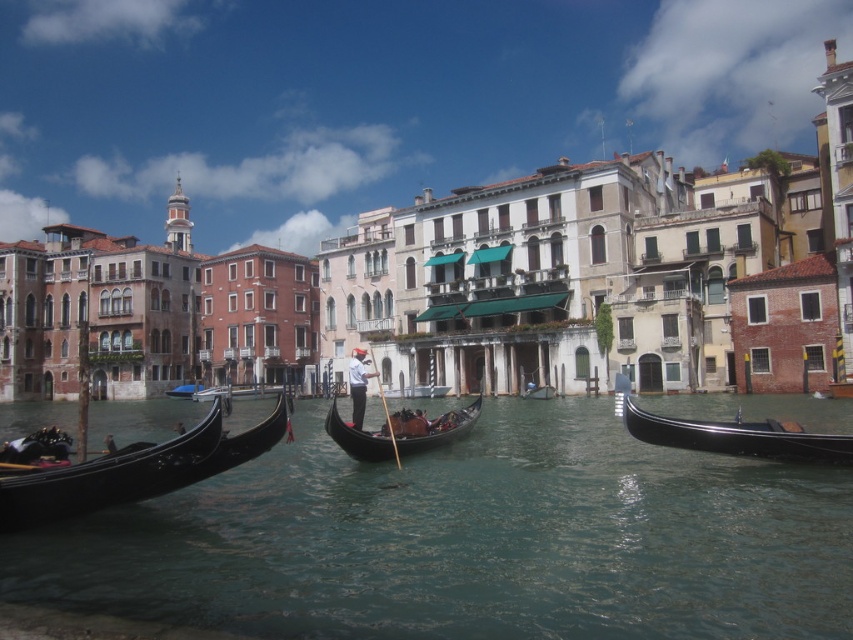
Question: Does uniformed man at center come behind wooden gondola at center?

Choices:
 (A) no
 (B) yes

Answer: (A)

Question: Which of the following is the closest to the observer?

Choices:
 (A) uniformed man at center
 (B) wooden gondola at center
 (C) shiny black gondola at right
 (D) black polished wood gondola at left

Answer: (D)

Question: Which object is the closest to the uniformed man at center?

Choices:
 (A) blue fabric boat at center
 (B) clear water at center
 (C) shiny black gondola at right

Answer: (B)

Question: Does black polished wood gondola at center have a lesser width compared to wooden gondola at center?

Choices:
 (A) yes
 (B) no

Answer: (B)

Question: Among these objects, which one is farthest from the camera?

Choices:
 (A) blue fabric boat at center
 (B) black polished wood gondola at center
 (C) wooden gondola at center
 (D) clear water at center

Answer: (A)

Question: Is black polished wood gondola at center thinner than uniformed man at center?

Choices:
 (A) yes
 (B) no

Answer: (B)